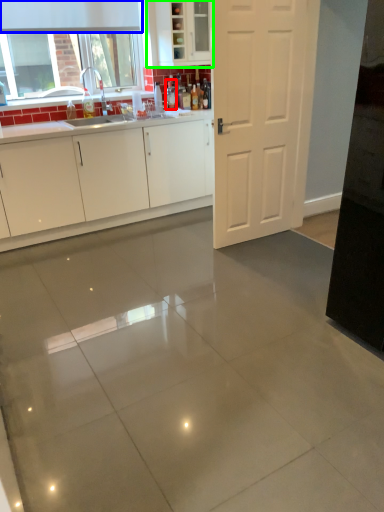
Question: Which is farther away from bottle (highlighted by a red box)? exhaust hood (highlighted by a blue box) or cabinetry (highlighted by a green box)?

Choices:
 (A) exhaust hood
 (B) cabinetry

Answer: (A)